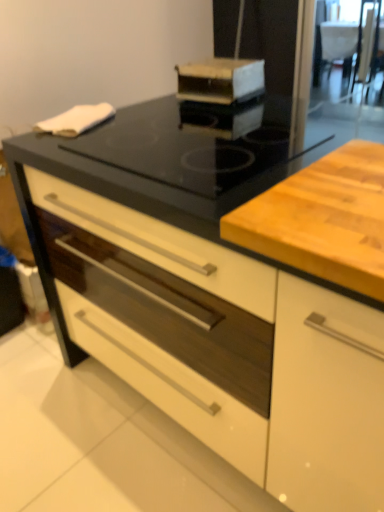
Question: Is wooden cutting board at center facing towards black glass gas stove at center?

Choices:
 (A) yes
 (B) no

Answer: (B)

Question: Does wooden cutting board at center come behind black glass gas stove at center?

Choices:
 (A) no
 (B) yes

Answer: (A)

Question: Is wooden cutting board at center completely or partially outside of black glass gas stove at center?

Choices:
 (A) yes
 (B) no

Answer: (A)

Question: Is wooden cutting board at center oriented away from black glass gas stove at center?

Choices:
 (A) no
 (B) yes

Answer: (A)

Question: From the image's perspective, would you say wooden cutting board at center is shown under black glass gas stove at center?

Choices:
 (A) no
 (B) yes

Answer: (B)

Question: Could black glass gas stove at center be considered to be inside wooden cutting board at center?

Choices:
 (A) no
 (B) yes

Answer: (A)

Question: Does wooden cutting board at center have a larger size compared to transparent glass screen door at upper right?

Choices:
 (A) no
 (B) yes

Answer: (A)

Question: From a real-world perspective, is wooden cutting board at center beneath transparent glass screen door at upper right?

Choices:
 (A) no
 (B) yes

Answer: (A)

Question: Considering the relative sizes of wooden cutting board at center and transparent glass screen door at upper right in the image provided, is wooden cutting board at center wider than transparent glass screen door at upper right?

Choices:
 (A) yes
 (B) no

Answer: (B)

Question: Is wooden cutting board at center thinner than transparent glass screen door at upper right?

Choices:
 (A) no
 (B) yes

Answer: (B)

Question: Is wooden cutting board at center positioned with its back to transparent glass screen door at upper right?

Choices:
 (A) no
 (B) yes

Answer: (B)

Question: From a real-world perspective, is wooden cutting board at center physically above transparent glass screen door at upper right?

Choices:
 (A) no
 (B) yes

Answer: (B)

Question: Can you confirm if transparent glass screen door at upper right is positioned to the left of wooden cutting board at center?

Choices:
 (A) yes
 (B) no

Answer: (B)